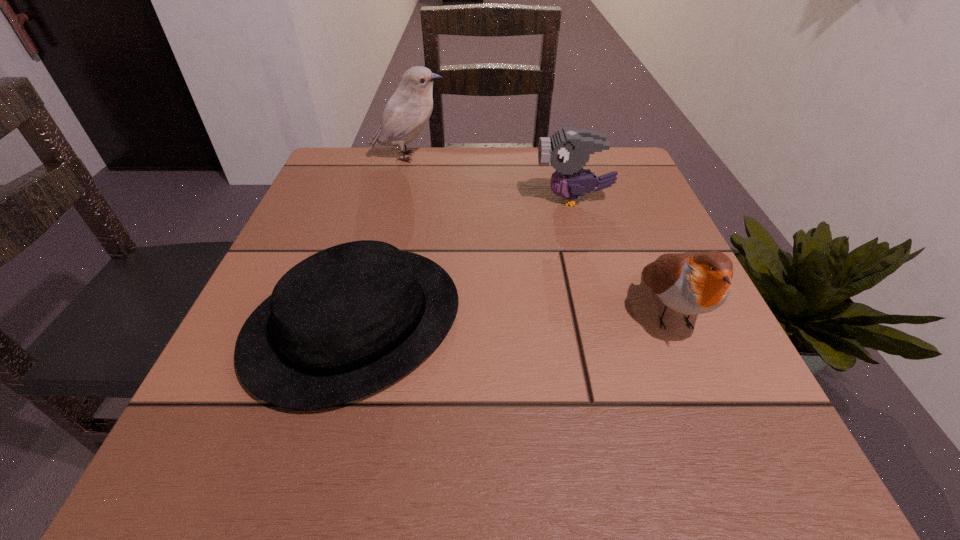
You are a GUI agent. You are given a task and a screenshot of the screen. Output one action in this format:
    pyautogui.click(x=<x>, y=<y>)
    Task: Click on the vacant area at the near left corner of the desktop
    
    Given the screenshot: What is the action you would take?
    pyautogui.click(x=277, y=481)

The image size is (960, 540). Identify the location of vacant area that lies between the tallest bird and the third nearest object. (491, 178).

Locate an element on the screen. free space between the tallest bird and the fedora is located at coordinates (381, 240).

This screenshot has height=540, width=960. Find the location of `vacant region between the shortest object and the second farthest object`. vacant region between the shortest object and the second farthest object is located at coordinates (464, 261).

Locate an element on the screen. vacant area between the third nearest object and the shortest object is located at coordinates pyautogui.click(x=464, y=261).

This screenshot has height=540, width=960. In order to click on free spot between the fedora and the farthest bird in this screenshot , I will do click(381, 240).

At what (x,y) coordinates should I click in order to perform the action: click on blank region between the fedora and the third nearest object. Please return your answer as a coordinate pair (x, y). Looking at the image, I should click on (464, 261).

You are a GUI agent. You are given a task and a screenshot of the screen. Output one action in this format:
    pyautogui.click(x=<x>, y=<y>)
    Task: Click on the free space between the second farthest object and the fedora
    
    Given the screenshot: What is the action you would take?
    pyautogui.click(x=464, y=261)

At what (x,y) coordinates should I click in order to perform the action: click on free space between the second nearest bird and the shortest object. Please return your answer as a coordinate pair (x, y). Image resolution: width=960 pixels, height=540 pixels. Looking at the image, I should click on (464, 261).

Where is `vacant area that lies between the farthest object and the nearest bird`? The height and width of the screenshot is (540, 960). vacant area that lies between the farthest object and the nearest bird is located at coordinates (540, 234).